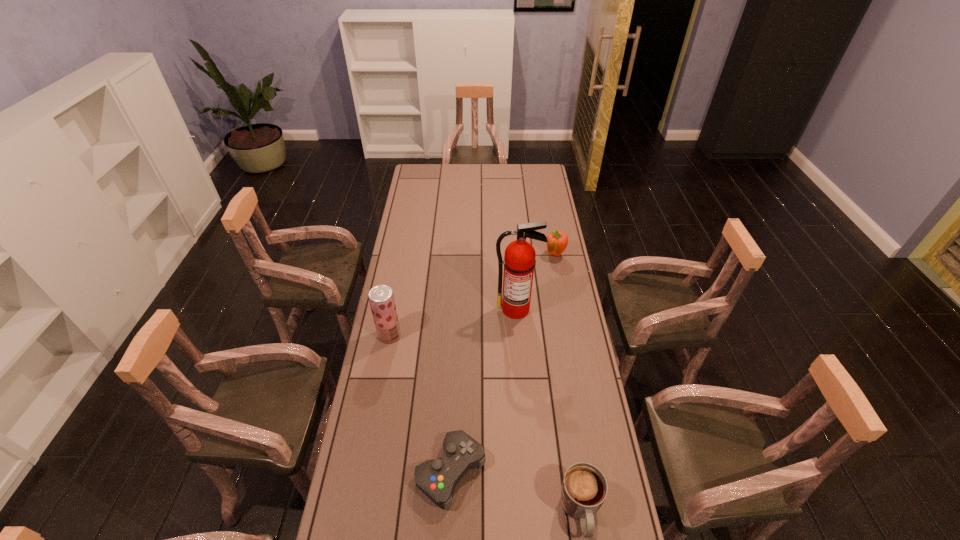
Where is `free space located on the front of the pepper`? This screenshot has height=540, width=960. free space located on the front of the pepper is located at coordinates (564, 306).

This screenshot has width=960, height=540. In order to click on free space located on the back of the control in this screenshot , I will do `click(453, 424)`.

This screenshot has height=540, width=960. I want to click on object present at the left edge, so click(381, 298).

Where is `fire extinguisher located in the right edge section of the desktop`? This screenshot has width=960, height=540. fire extinguisher located in the right edge section of the desktop is located at coordinates (519, 261).

Find the location of a particular element. The image size is (960, 540). pepper at the right edge is located at coordinates (557, 241).

You are a GUI agent. You are given a task and a screenshot of the screen. Output one action in this format:
    pyautogui.click(x=<x>, y=<y>)
    Task: Click on the free location at the far edge of the desktop
    The width and height of the screenshot is (960, 540).
    Given the screenshot: What is the action you would take?
    click(x=467, y=165)

The width and height of the screenshot is (960, 540). Identify the location of free space at the left edge. (402, 271).

Locate an element on the screen. vacant region at the right edge of the desktop is located at coordinates (555, 440).

Image resolution: width=960 pixels, height=540 pixels. Find the location of `free space at the far right corner of the desktop`. free space at the far right corner of the desktop is located at coordinates (535, 172).

At what (x,y) coordinates should I click in order to perform the action: click on empty location between the third tallest object and the second farthest object. Please return your answer as a coordinate pair (x, y). The image size is (960, 540). Looking at the image, I should click on (536, 282).